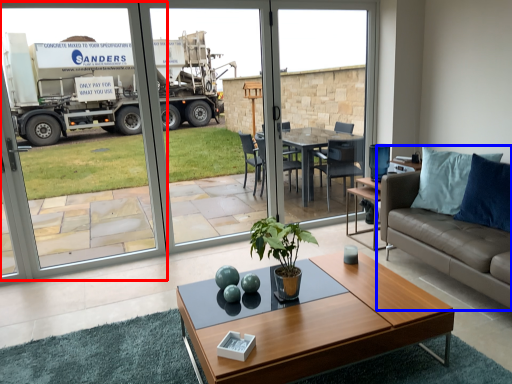
Question: Which point is closer to the camera, screen door (highlighted by a red box) or studio couch (highlighted by a blue box)?

Choices:
 (A) screen door
 (B) studio couch

Answer: (B)